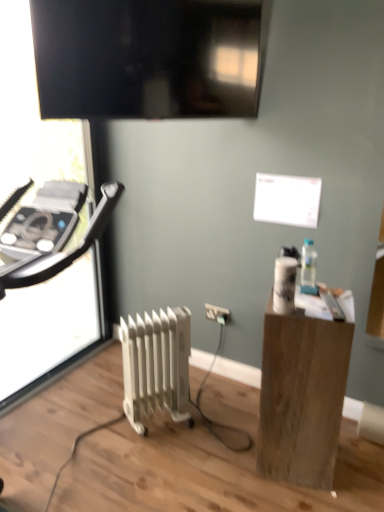
Where is `vacant space to the left of wooden block at right`? Image resolution: width=384 pixels, height=512 pixels. vacant space to the left of wooden block at right is located at coordinates (222, 462).